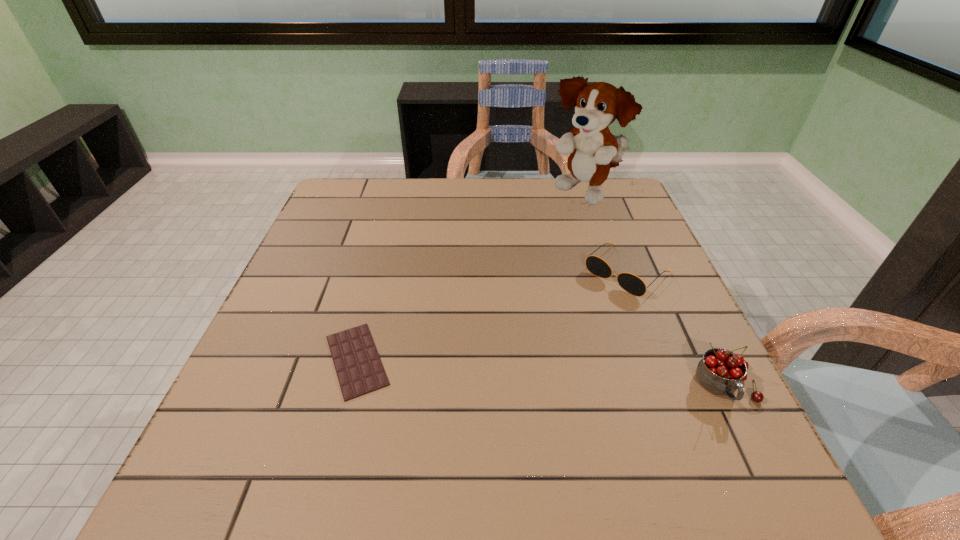
This screenshot has height=540, width=960. What are the coordinates of `vacant space located on the face of the puppy` in the screenshot? It's located at (537, 284).

Find the location of a particular element. The width and height of the screenshot is (960, 540). vacant space situated 0.140m on the front-facing side of the third tallest object is located at coordinates (568, 325).

Find the location of a particular element. vacant space located 0.060m on the front-facing side of the third tallest object is located at coordinates (589, 306).

Find the location of a particular element. The image size is (960, 540). vacant area located 0.140m on the front-facing side of the third tallest object is located at coordinates (568, 325).

At what (x,y) coordinates should I click in order to perform the action: click on object that is positioned at the far edge. Please return your answer as a coordinate pair (x, y). This screenshot has width=960, height=540. Looking at the image, I should click on (598, 105).

In order to click on chocolate bar located at the near edge in this screenshot , I will do `click(359, 369)`.

The width and height of the screenshot is (960, 540). What are the coordinates of `pot filled with cherries located at the near edge` in the screenshot? It's located at (721, 372).

The image size is (960, 540). What are the coordinates of `object that is at the left edge` in the screenshot? It's located at (359, 369).

Image resolution: width=960 pixels, height=540 pixels. In order to click on pot filled with cherries positioned at the right edge in this screenshot , I will do `click(721, 372)`.

Identify the location of puppy present at the right edge. (598, 105).